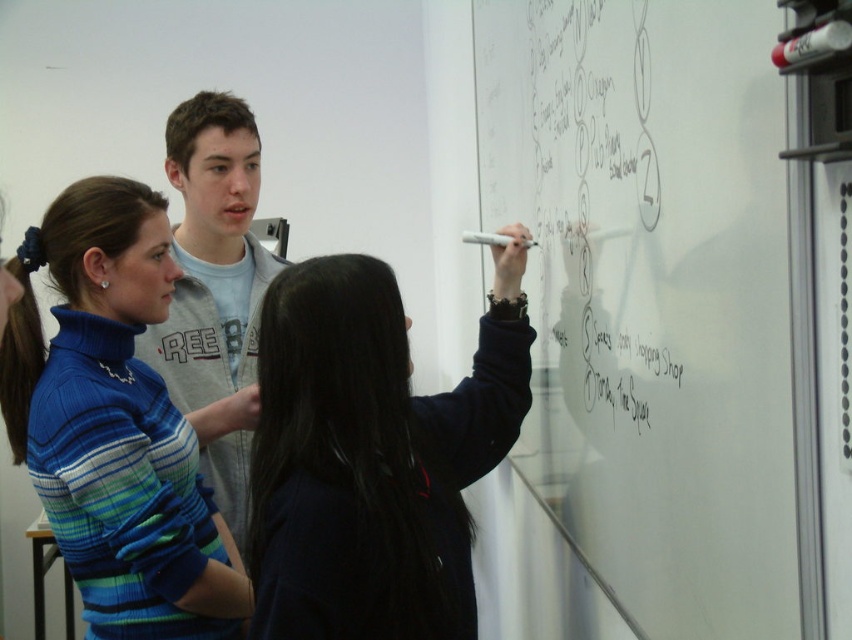
You are standing in the classroom and want to hand a marker to the person wearing the dark blue sweater at center. Since the white matte board at center is in the way, can you reach them without moving the board?

The white matte board at center is closer to the viewer than dark blue sweater at center, so you cannot reach the dark blue sweater at center directly without moving the board because it is obstructed by the board.

You are standing in the classroom and need to place a new poster on the wall. The poster must be placed to the right of the white matte board at center. Where should you position it?

The white matte board at center is located at point (652, 296). To place the poster to the right of it, position it at a coordinate with an x value greater than 0.463 and the same y value.

You are a teacher in the classroom and want to call on the student wearing the dark blue sweater at center. Which side of the light gray sweatshirt at center should you point to locate them?

The dark blue sweater at center is to the right of the light gray sweatshirt at center, so you should point to the right side of the light gray sweatshirt at center to locate them.